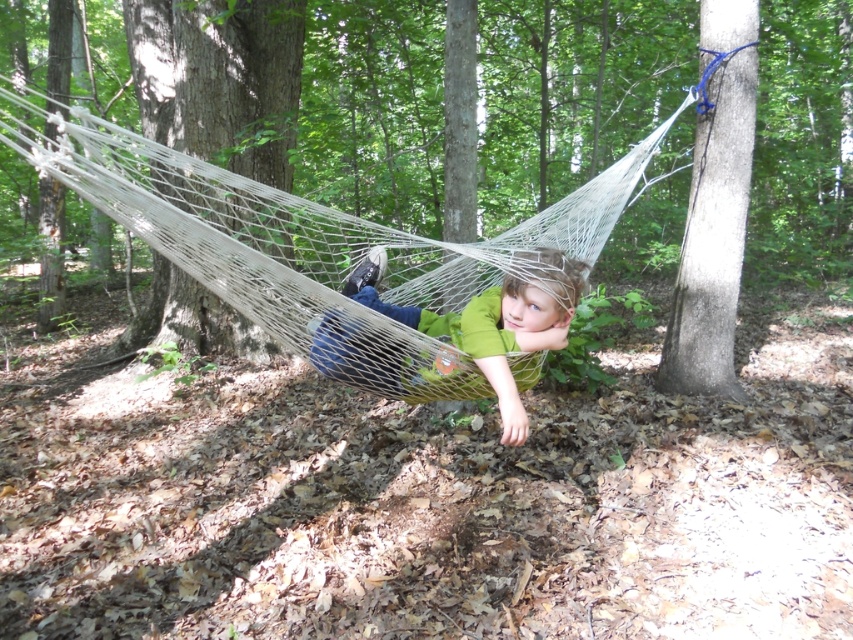
Who is taller, brown rough tree at center or smooth gray bark at upper left?

With more height is brown rough tree at center.

Measure the distance from brown rough tree at center to smooth gray bark at upper left.

brown rough tree at center and smooth gray bark at upper left are 4.95 feet apart.

You are a GUI agent. You are given a task and a screenshot of the screen. Output one action in this format:
    pyautogui.click(x=<x>, y=<y>)
    Task: Click on the brown rough tree at center
    The image size is (853, 640).
    Given the screenshot: What is the action you would take?
    pyautogui.click(x=405, y=232)

Does smooth gray bark at upper left have a greater width compared to green fabric child at center?

Yes, smooth gray bark at upper left is wider than green fabric child at center.

Does point (277, 173) come in front of point (358, 292)?

No, it is not.

The height and width of the screenshot is (640, 853). What are the coordinates of `smooth gray bark at upper left` in the screenshot? It's located at (219, 77).

Between smooth gray bark at upper right and green fabric child at center, which one has more height?

Standing taller between the two is smooth gray bark at upper right.

Based on the photo, does smooth gray bark at upper right have a greater width compared to green fabric child at center?

In fact, smooth gray bark at upper right might be narrower than green fabric child at center.

Image resolution: width=853 pixels, height=640 pixels. In order to click on smooth gray bark at upper right in this screenshot , I will do `click(714, 211)`.